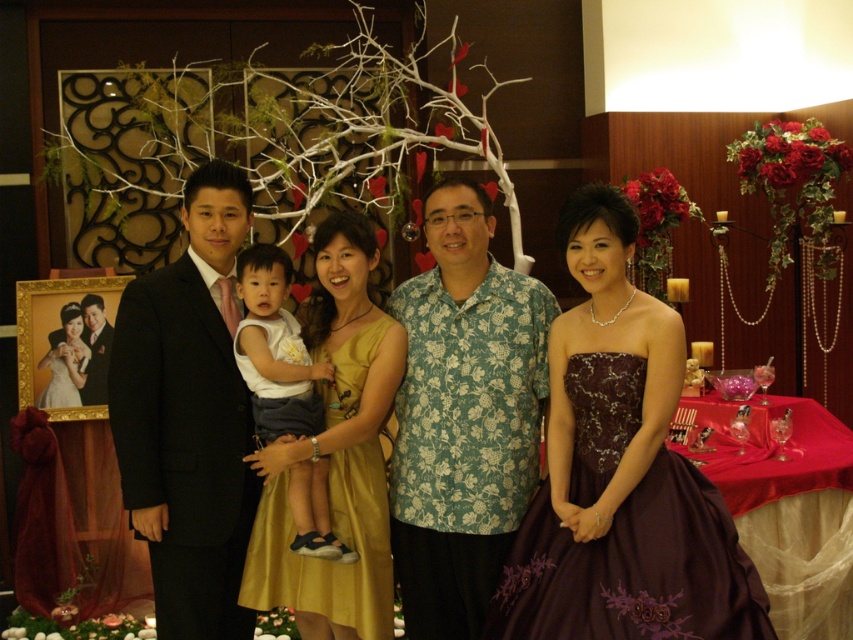
Question: Does matte black suit at left have a lesser width compared to green floral shirt at center?

Choices:
 (A) yes
 (B) no

Answer: (B)

Question: Based on their relative distances, which object is farther from the purple satin dress at center?

Choices:
 (A) black suit at center
 (B) green floral shirt at center

Answer: (A)

Question: Is green floral shirt at center wider than black suit at center?

Choices:
 (A) no
 (B) yes

Answer: (B)

Question: Can you confirm if purple satin dress at center is thinner than green floral shirt at center?

Choices:
 (A) no
 (B) yes

Answer: (A)

Question: Which point is closer to the camera?

Choices:
 (A) green floral shirt at center
 (B) white cotton shirt at center
 (C) black suit at center

Answer: (B)

Question: Considering the real-world distances, which object is farthest from the matte black suit at left?

Choices:
 (A) purple satin dress at center
 (B) white cotton shirt at center
 (C) green floral shirt at center

Answer: (B)